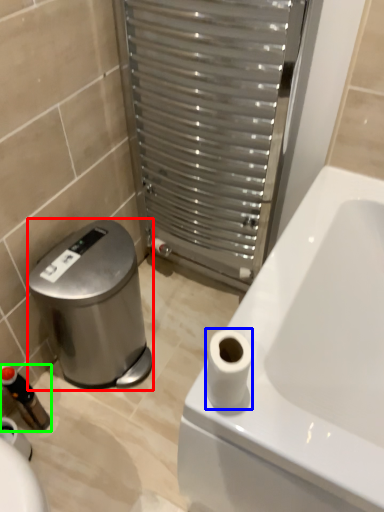
Question: Based on their relative distances, which object is nearer to water cooler (highlighted by a red box)? Choose from toilet paper (highlighted by a blue box) and toiletry (highlighted by a green box).

Choices:
 (A) toilet paper
 (B) toiletry

Answer: (B)